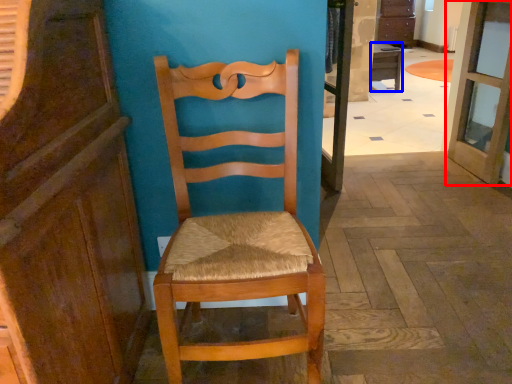
Question: Which point is closer to the camera, door (highlighted by a red box) or desk (highlighted by a blue box)?

Choices:
 (A) door
 (B) desk

Answer: (A)